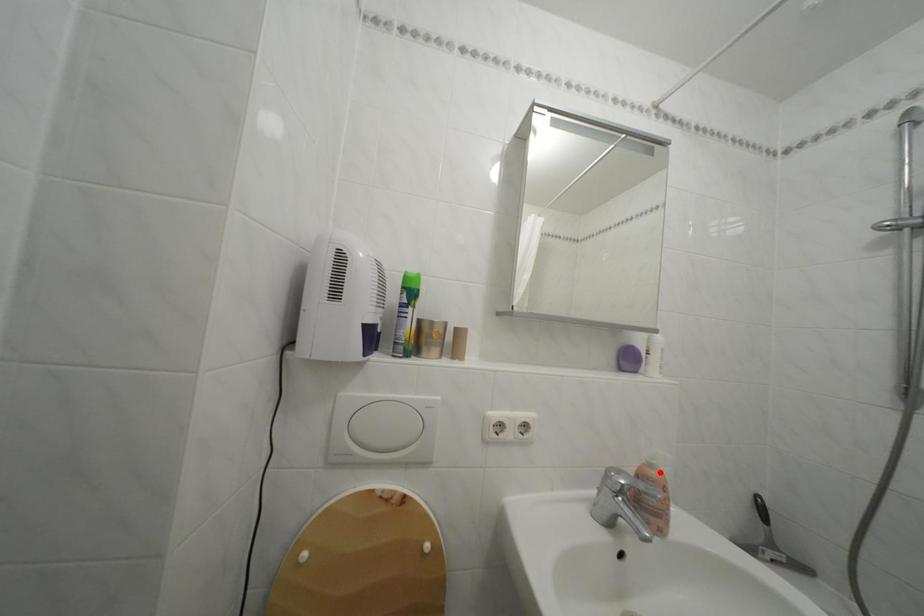
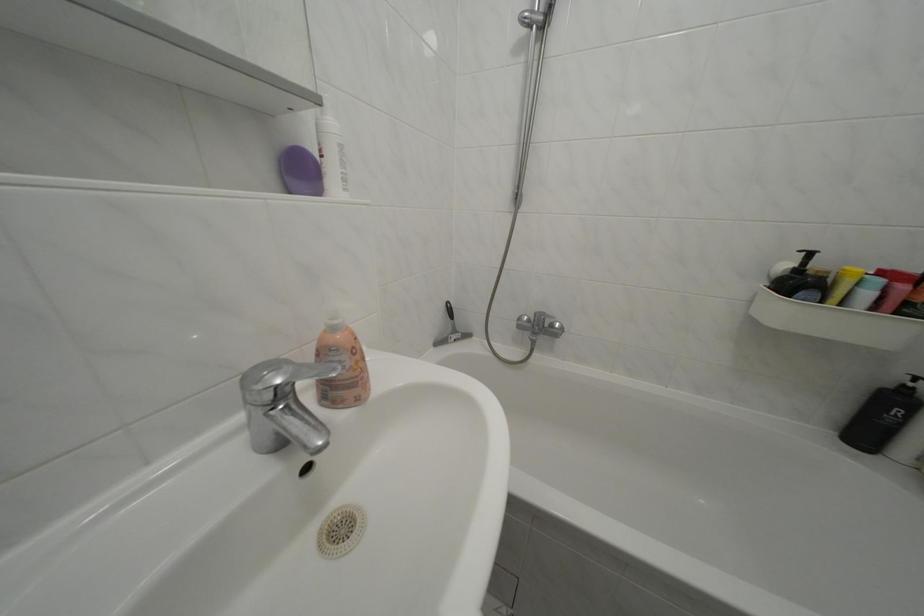
In the second image, find the point that corresponds to the highlighted location in the first image.

(342, 334)